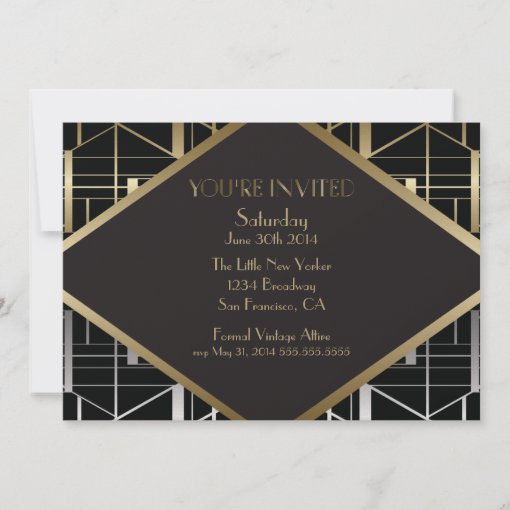
Where is `gold border`? gold border is located at coordinates tap(448, 225).